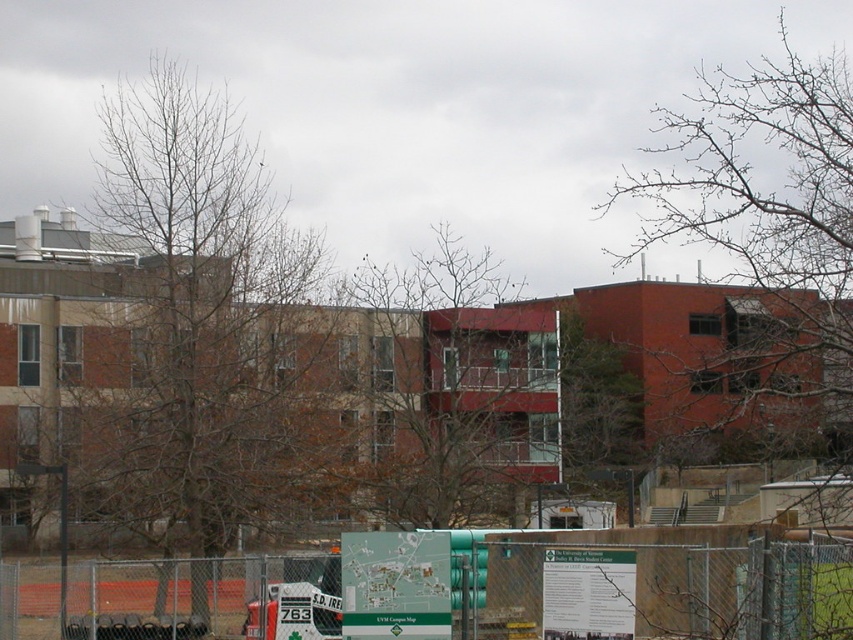
Can you confirm if bare branches at left is bigger than metal chain-link fence at center?

Yes, bare branches at left is bigger than metal chain-link fence at center.

What are the coordinates of `bare branches at left` in the screenshot? It's located at (198, 330).

Is point (172, 218) positioned in front of point (468, 557)?

No, (172, 218) is further to viewer.

You are a GUI agent. You are given a task and a screenshot of the screen. Output one action in this format:
    pyautogui.click(x=<x>, y=<y>)
    Task: Click on the bare branches at left
    The width and height of the screenshot is (853, 640).
    Given the screenshot: What is the action you would take?
    pyautogui.click(x=198, y=330)

Which of these two, metal chain-link fence at center or bare branches at upper right, stands shorter?

metal chain-link fence at center is shorter.

Does metal chain-link fence at center have a smaller size compared to bare branches at upper right?

Yes.

Who is more forward, (495, 568) or (654, 145)?

Point (495, 568) is in front.

This screenshot has height=640, width=853. Find the location of `metal chain-link fence at center`. metal chain-link fence at center is located at coordinates (461, 589).

Does bare branches at upper right appear on the left side of bare branches at center?

Answer: No, bare branches at upper right is not to the left of bare branches at center.

This screenshot has width=853, height=640. Describe the element at coordinates (766, 204) in the screenshot. I see `bare branches at upper right` at that location.

Is point (608, 209) more distant than point (491, 278)?

Yes, it is.

Find the location of a particular element. Image resolution: width=853 pixels, height=640 pixels. bare branches at upper right is located at coordinates (766, 204).